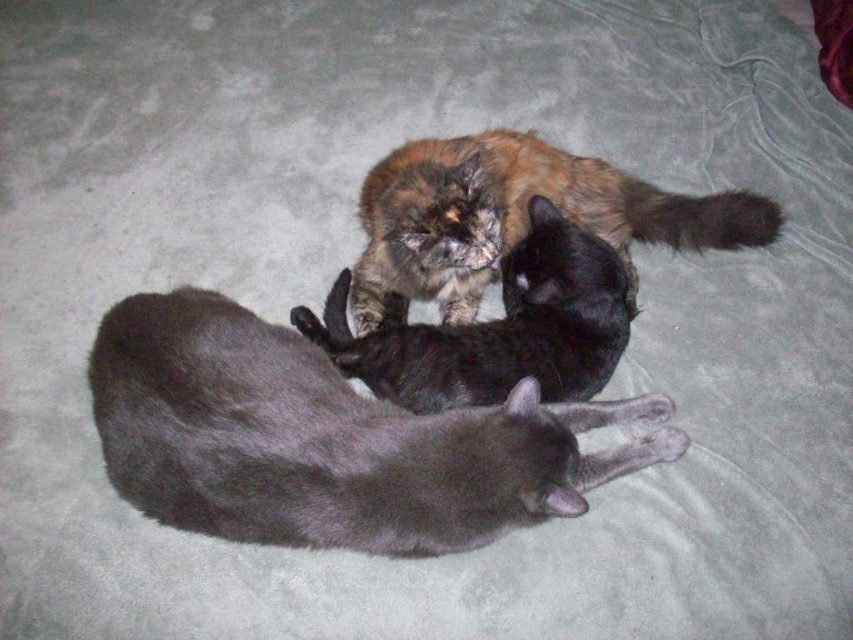
Between point (746, 211) and point (529, 301), which one is positioned behind?

The point (746, 211) is behind.

Who is shorter, multicolored fur cat at center or multicolored fluffy cat at center?

Standing shorter between the two is multicolored fluffy cat at center.

Is point (413, 294) positioned in front of point (419, 353)?

No, (413, 294) is further to viewer.

Find the location of `multicolored fur cat at center`. multicolored fur cat at center is located at coordinates [x=515, y=216].

I want to click on silky gray cat at center, so click(x=328, y=440).

Can you confirm if silky gray cat at center is positioned below multicolored fur cat at center?

Indeed, silky gray cat at center is positioned under multicolored fur cat at center.

Image resolution: width=853 pixels, height=640 pixels. Find the location of `silky gray cat at center`. silky gray cat at center is located at coordinates click(x=328, y=440).

The height and width of the screenshot is (640, 853). Identify the location of silky gray cat at center. (328, 440).

Is silky gray cat at center taller than multicolored fluffy cat at center?

Yes.

Locate an element on the screen. silky gray cat at center is located at coordinates click(328, 440).

The width and height of the screenshot is (853, 640). What are the coordinates of `silky gray cat at center` in the screenshot? It's located at (328, 440).